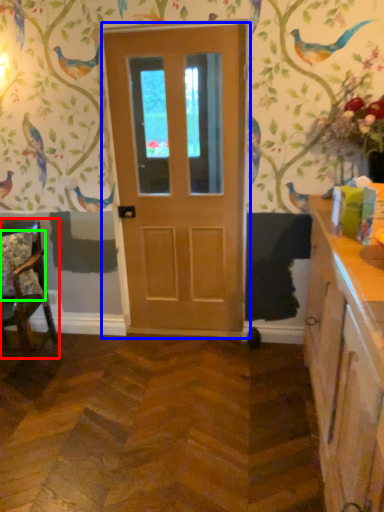
Question: Estimate the real-world distances between objects in this image. Which object is closer to chair (highlighted by a red box), door (highlighted by a blue box) or pillow (highlighted by a green box)?

Choices:
 (A) door
 (B) pillow

Answer: (B)